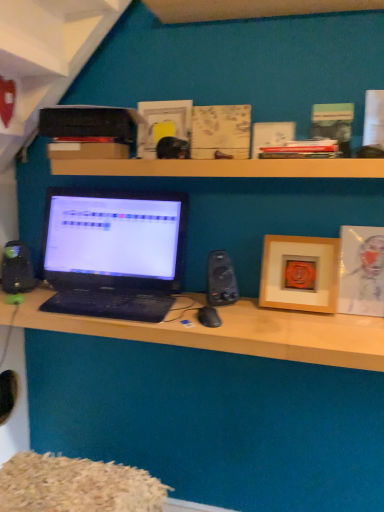
Find the location of a particular element. This screenshot has width=384, height=512. free space in front of black plastic speaker at center-right, the second speaker in the left-to-right sequence is located at coordinates (234, 320).